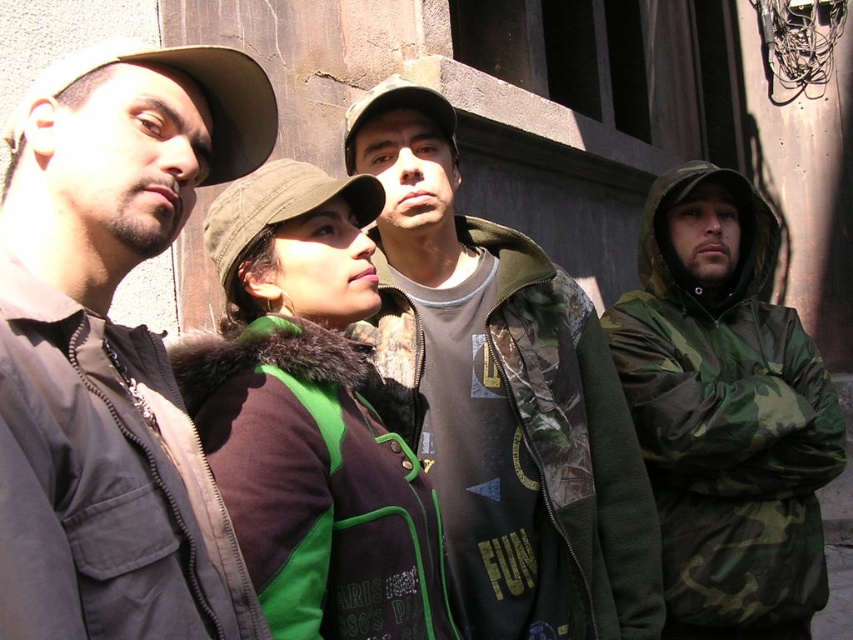
Who is lower down, camo jacket at center or brown fabric baseball cap at upper left?

camo jacket at center is below.

Can you confirm if camo jacket at center is positioned to the right of brown fabric baseball cap at upper left?

Correct, you'll find camo jacket at center to the right of brown fabric baseball cap at upper left.

At what (x,y) coordinates should I click in order to perform the action: click on camo jacket at center. Please return your answer as a coordinate pair (x, y). Looking at the image, I should click on (503, 397).

Does green fuzzy jacket at center appear under green fabric baseball cap at center?

Indeed, green fuzzy jacket at center is positioned under green fabric baseball cap at center.

The height and width of the screenshot is (640, 853). Describe the element at coordinates (316, 483) in the screenshot. I see `green fuzzy jacket at center` at that location.

This screenshot has height=640, width=853. What are the coordinates of `green fuzzy jacket at center` in the screenshot? It's located at (316, 483).

You are a GUI agent. You are given a task and a screenshot of the screen. Output one action in this format:
    pyautogui.click(x=<x>, y=<y>)
    Task: Click on the green fuzzy jacket at center
    The height and width of the screenshot is (640, 853).
    Given the screenshot: What is the action you would take?
    pyautogui.click(x=316, y=483)

Does green fuzzy jacket at center appear under brown fabric baseball cap at upper left?

Yes.

Between point (339, 384) and point (259, 113), which one is positioned in front?

Point (259, 113)

The image size is (853, 640). Identify the location of green fuzzy jacket at center. (316, 483).